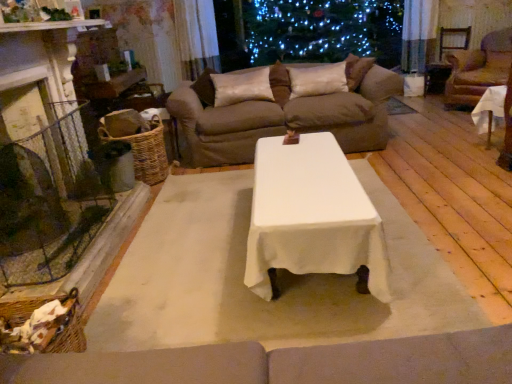
Find the location of a particular element. This screenshot has width=512, height=384. free space to the back side of white cloth-covered table at right is located at coordinates (460, 140).